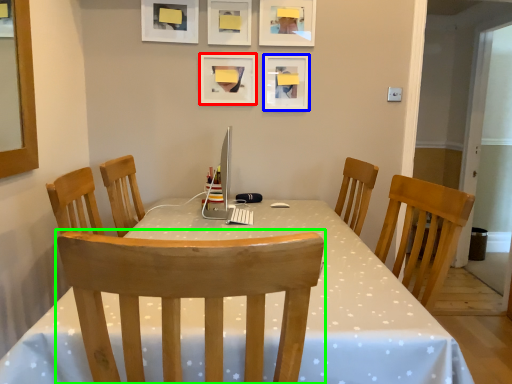
Question: Which object is positioned closest to picture frame (highlighted by a red box)? Select from picture frame (highlighted by a blue box) and chair (highlighted by a green box).

Choices:
 (A) picture frame
 (B) chair

Answer: (A)